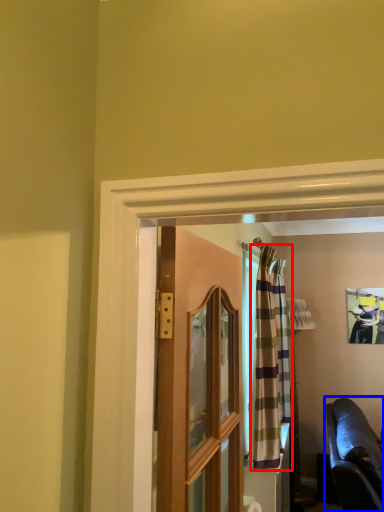
Question: Which point is further to the camera, curtain (highlighted by a red box) or studio couch (highlighted by a blue box)?

Choices:
 (A) curtain
 (B) studio couch

Answer: (A)